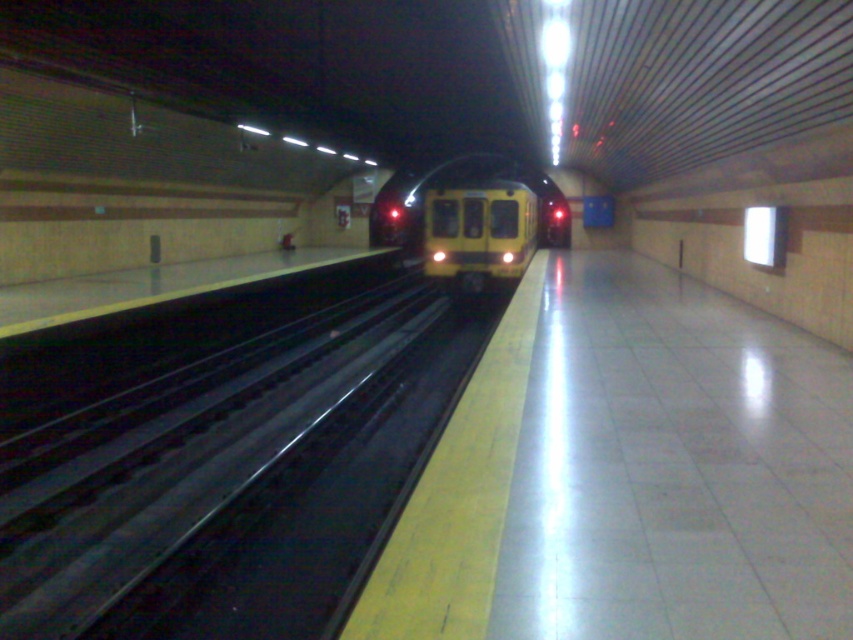
Question: Is black metal track at center bigger than yellow matte train at center?

Choices:
 (A) yes
 (B) no

Answer: (A)

Question: Among these points, which one is nearest to the camera?

Choices:
 (A) (175, 589)
 (B) (469, 292)

Answer: (A)

Question: Is black metal track at center bigger than yellow matte train at center?

Choices:
 (A) no
 (B) yes

Answer: (B)

Question: Which object is closer to the camera taking this photo?

Choices:
 (A) yellow matte train at center
 (B) black metal track at center

Answer: (B)

Question: Does black metal track at center have a larger size compared to yellow matte train at center?

Choices:
 (A) no
 (B) yes

Answer: (B)